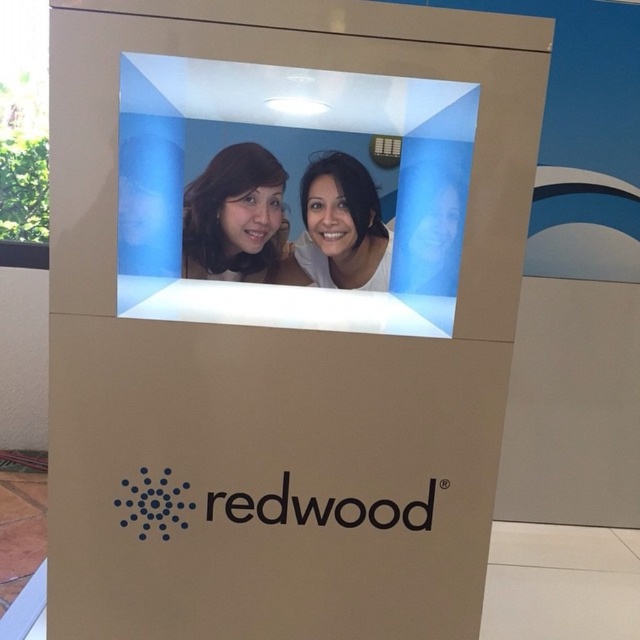
Question: Is the position of matte black hair at center more distant than that of matte white face at center?

Choices:
 (A) yes
 (B) no

Answer: (B)

Question: Which of the following is the closest to the observer?

Choices:
 (A) (365, 252)
 (B) (228, 161)

Answer: (B)

Question: Which point is closer to the camera?

Choices:
 (A) (340, 252)
 (B) (278, 230)

Answer: (A)

Question: Does matte black hair at center have a larger size compared to matte white face at center?

Choices:
 (A) no
 (B) yes

Answer: (B)

Question: Which point appears closest to the camera in this image?

Choices:
 (A) (312, 196)
 (B) (268, 177)

Answer: (B)

Question: Can you confirm if matte black hair at center is positioned above matte white face at center?

Choices:
 (A) yes
 (B) no

Answer: (A)